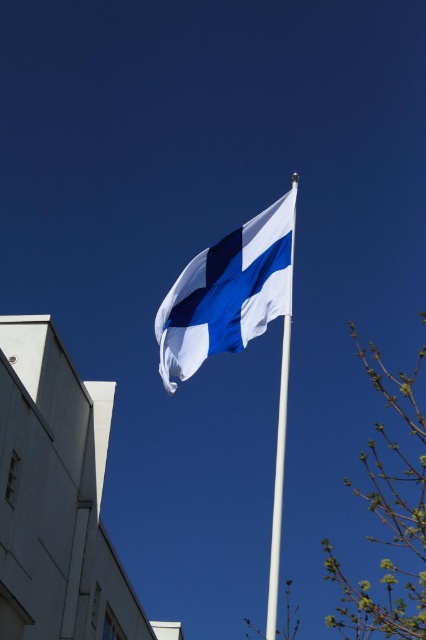
Question: From the image, what is the correct spatial relationship of white fabric flag at center in relation to white metallic pole at center?

Choices:
 (A) right
 (B) left

Answer: (B)

Question: Which of the following is the closest to the observer?

Choices:
 (A) (235, 269)
 (B) (273, 611)

Answer: (B)

Question: Among these points, which one is nearest to the camera?

Choices:
 (A) (288, 285)
 (B) (270, 620)

Answer: (B)

Question: Considering the relative positions of white fabric flag at center and white metallic pole at center in the image provided, where is white fabric flag at center located with respect to white metallic pole at center?

Choices:
 (A) below
 (B) above

Answer: (B)

Question: Is white fabric flag at center bigger than white metallic pole at center?

Choices:
 (A) yes
 (B) no

Answer: (B)